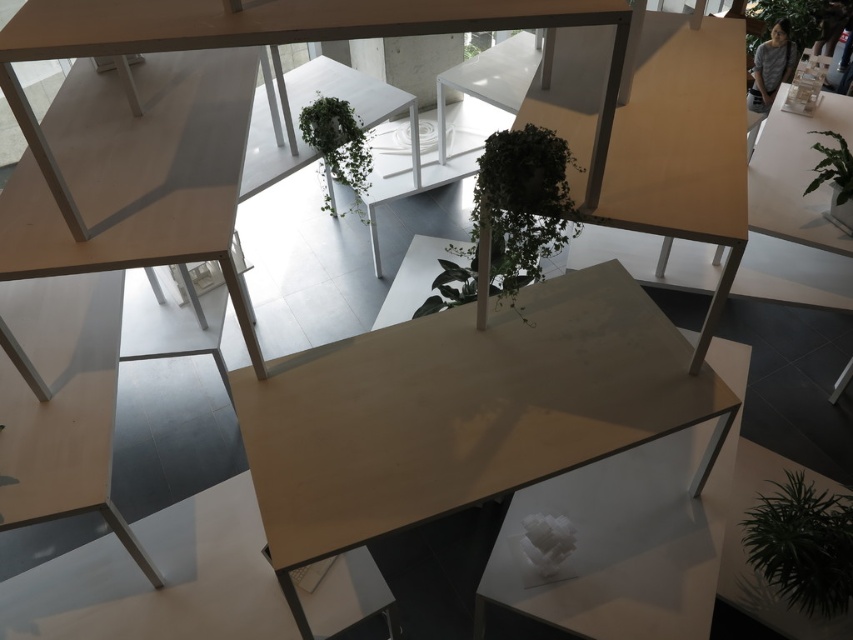
You are standing in the room and want to place a new plant pot between the green leafy plant at center and the green leafy plant at upper right. Based on their positions, which direction should you move the new plant pot from the center plant to reach the upper right plant?

You should move the new plant pot to the right from the green leafy plant at center to reach the green leafy plant at upper right, as the green leafy plant at center is to the left of green leafy plant at upper right.

You are arranging plants in a modern minimalist room. You have a green matte plant at center and a green leafy plant at right. Which plant is placed above the other?

The green matte plant at center is positioned over green leafy plant at right.

You are standing in the room and want to water the green leafy plant at upper right. Which direction should you move to reach it first, considering the green leafy plant at center is blocking your view?

Since the green leafy plant at center is in front of the green leafy plant at upper right, you should move towards the upper right direction to reach the plant behind the one blocking your view.